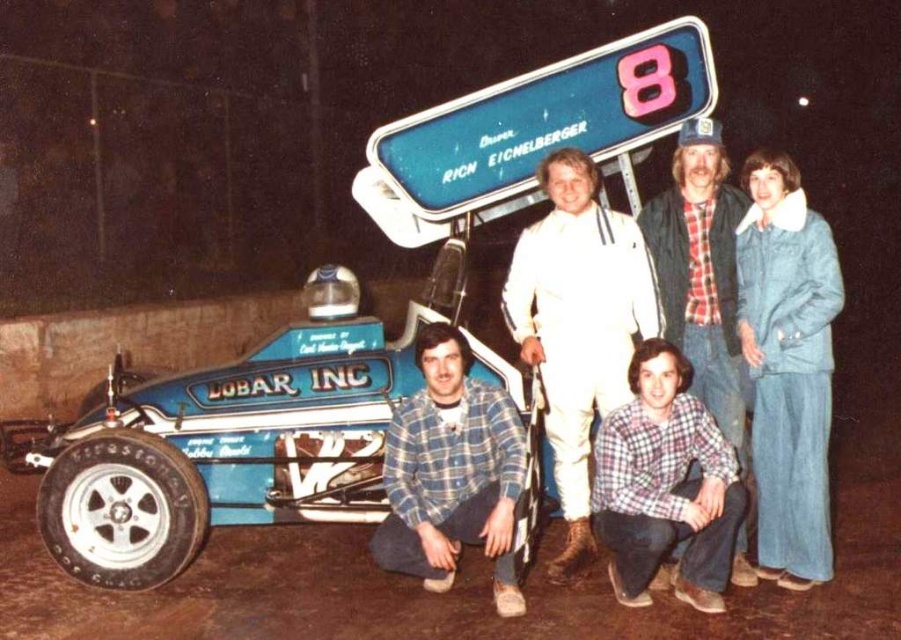
Between point (474, 108) and point (433, 540), which one is positioned in front?

Point (433, 540) is in front.

You are a GUI agent. You are given a task and a screenshot of the screen. Output one action in this format:
    pyautogui.click(x=<x>, y=<y>)
    Task: Click on the blue plastic sign at upper center
    
    Given the screenshot: What is the action you would take?
    pyautogui.click(x=545, y=120)

At what (x,y) coordinates should I click in order to perform the action: click on blue plastic sign at upper center. Please return your answer as a coordinate pair (x, y). The width and height of the screenshot is (901, 640). Looking at the image, I should click on (545, 120).

Who is lower down, brown dirt track at lower center or blue plaid shirt at lower center?

Positioned lower is brown dirt track at lower center.

Is point (662, 620) in front of point (502, 403)?

Yes, it is.

Is point (478, 605) in front of point (433, 524)?

Yes, it is in front of point (433, 524).

Where is `brown dirt track at lower center`? brown dirt track at lower center is located at coordinates (438, 595).

Who is more distant from viewer, (x=607, y=481) or (x=417, y=548)?

Point (x=607, y=481)

What do you see at coordinates (665, 486) in the screenshot? Image resolution: width=901 pixels, height=640 pixels. I see `plaid flannel shirt at lower center` at bounding box center [665, 486].

What are the coordinates of `plaid flannel shirt at lower center` in the screenshot? It's located at (665, 486).